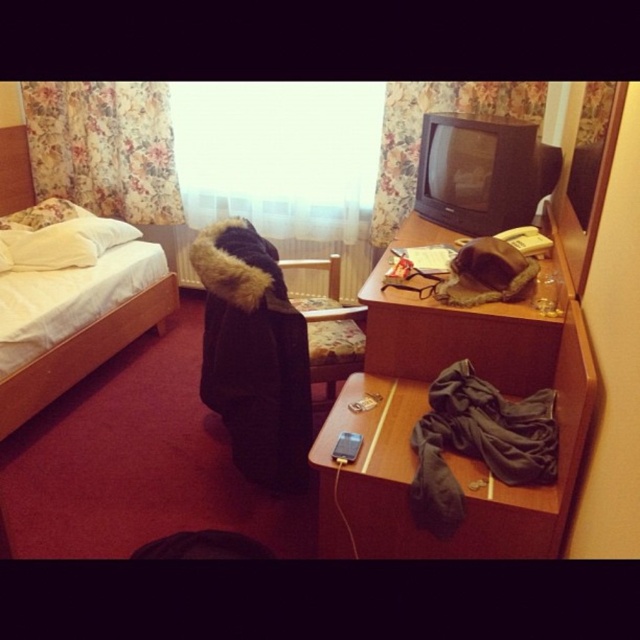
Who is shorter, wooden desk at center or white soft bed at left?

Standing shorter between the two is wooden desk at center.

Does wooden desk at center lie in front of white soft bed at left?

Yes, it is in front of white soft bed at left.

Between point (531, 368) and point (122, 339), which one is positioned in front?

Positioned in front is point (531, 368).

This screenshot has width=640, height=640. Find the location of `wooden desk at center`. wooden desk at center is located at coordinates (452, 452).

Can you confirm if wooden desk at center is thinner than black fur-trimmed coat at center?

Incorrect, wooden desk at center's width is not less than black fur-trimmed coat at center's.

Identify the location of wooden desk at center. (452, 452).

Where is `wooden desk at center`? wooden desk at center is located at coordinates (452, 452).

Locate an element on the screen. The image size is (640, 640). wooden desk at center is located at coordinates (452, 452).

Is white soft bed at left thinner than black fur-trimmed coat at center?

No.

Is white soft bed at left to the right of black fur-trimmed coat at center from the viewer's perspective?

In fact, white soft bed at left is to the left of black fur-trimmed coat at center.

Between point (160, 304) and point (237, 440), which one is positioned in front?

Positioned in front is point (237, 440).

The height and width of the screenshot is (640, 640). What are the coordinates of `white soft bed at left` in the screenshot? It's located at (74, 307).